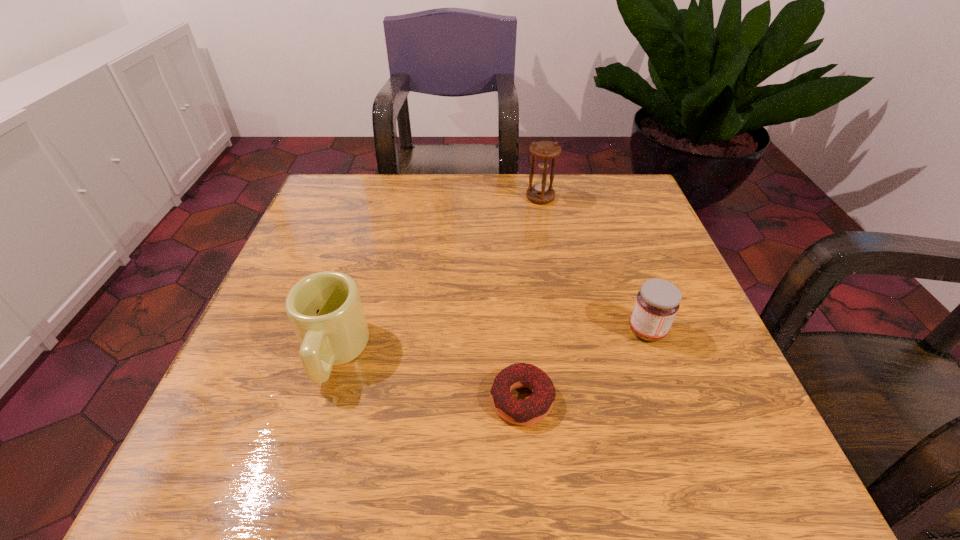
Find the location of a particular element. vacant space located 0.370m on the left of the shortest object is located at coordinates [x=257, y=400].

You are a GUI agent. You are given a task and a screenshot of the screen. Output one action in this format:
    pyautogui.click(x=<x>, y=<y>)
    Task: Click on the object present at the far edge
    
    Given the screenshot: What is the action you would take?
    pyautogui.click(x=541, y=192)

Identify the location of object that is at the near edge. The width and height of the screenshot is (960, 540). [536, 407].

Image resolution: width=960 pixels, height=540 pixels. Identify the location of object located in the left edge section of the desktop. (325, 310).

You are a GUI agent. You are given a task and a screenshot of the screen. Output one action in this format:
    pyautogui.click(x=<x>, y=<y>)
    Task: Click on the object positioned at the right edge
    The image size is (960, 540).
    Given the screenshot: What is the action you would take?
    pyautogui.click(x=657, y=302)

The width and height of the screenshot is (960, 540). What are the coordinates of `vacant space at the far edge of the desktop` in the screenshot? It's located at (525, 179).

At what (x,y) coordinates should I click in order to perform the action: click on vacant area at the near edge of the desktop. Please return your answer as a coordinate pair (x, y). This screenshot has width=960, height=540. Looking at the image, I should click on (369, 427).

Locate an element on the screen. This screenshot has width=960, height=540. blank space at the left edge of the desktop is located at coordinates (278, 320).

In order to click on vacant space at the right edge of the desktop in this screenshot , I will do `click(674, 323)`.

You are a GUI agent. You are given a task and a screenshot of the screen. Output one action in this format:
    pyautogui.click(x=<x>, y=<y>)
    Task: Click on the vacant position at the far left corner of the desktop
    This screenshot has height=540, width=960.
    Given the screenshot: What is the action you would take?
    coord(363,218)